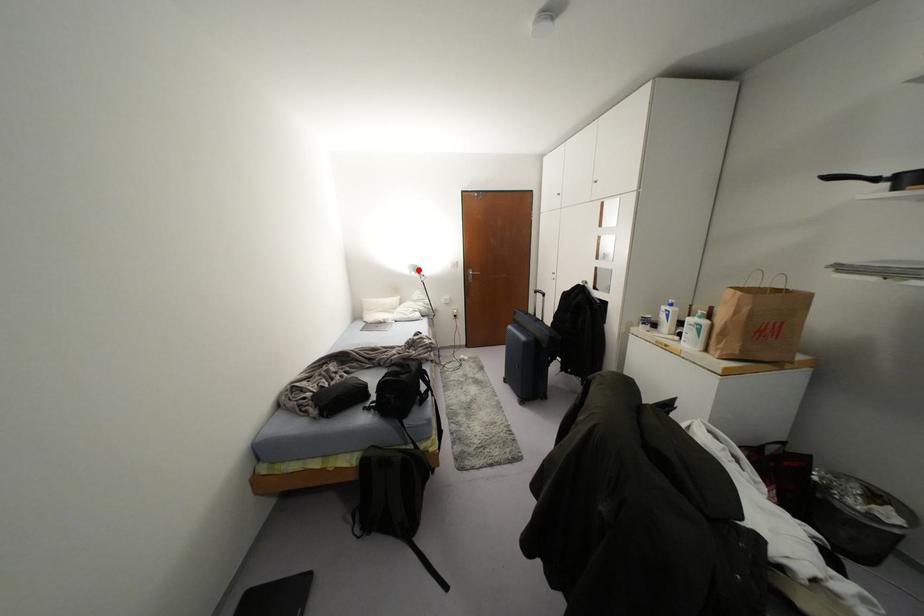
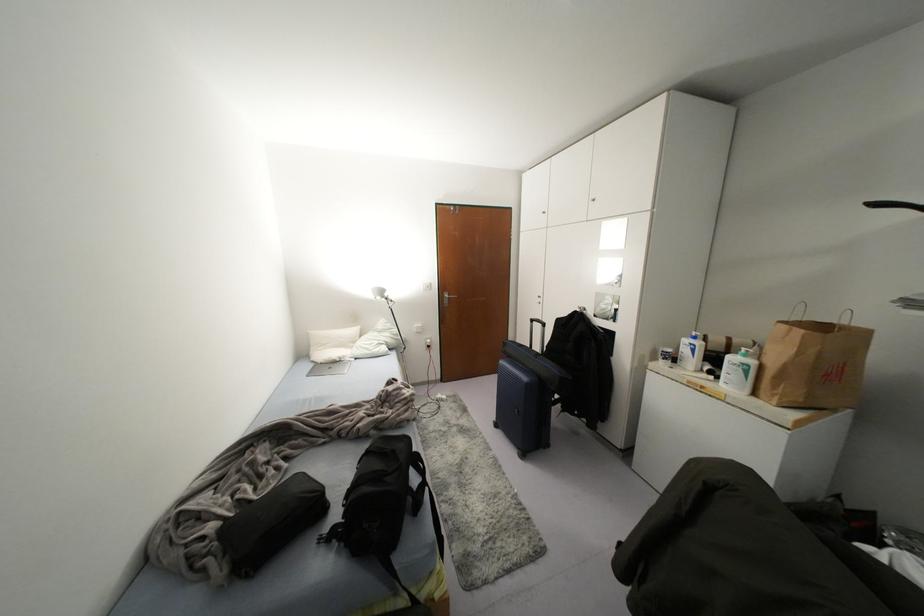
Find the pixel in the second image that matches the highlighted location in the first image.

(385, 294)